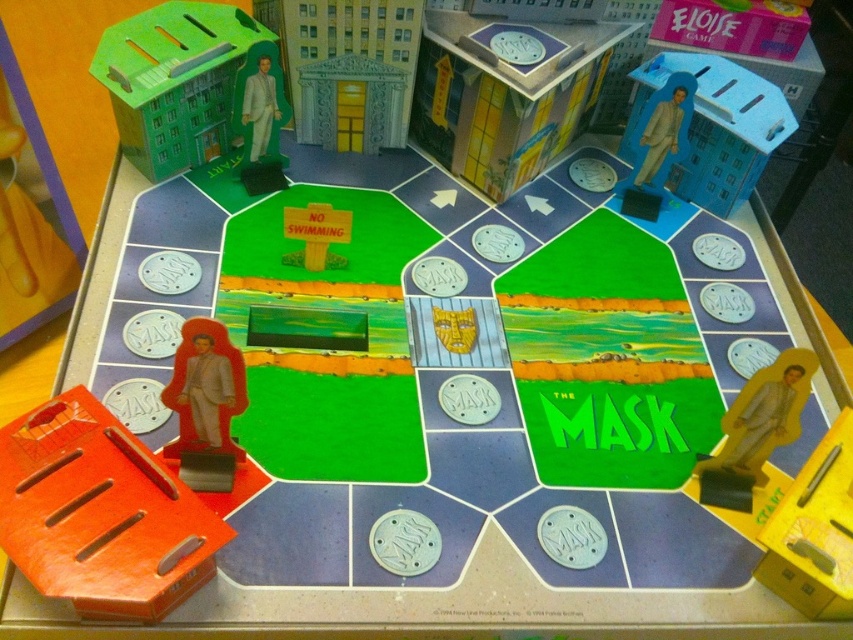
You are setting up the board game and need to place the matte plastic figure at upper right and the matte red figurine at lower left on the board. If the space you have available is only 5 cm wide, which figure should you place first to ensure it fits?

The matte red figurine at lower left should be placed first because it is narrower than the matte plastic figure at upper right, which is wider and might not fit in the 5 cm space.

You are playing The Mask board game and your game piece is the matte gray suit at upper center. There is a matte plastic building at upper center that you need to reach. In which direction should you move to get closer to the building?

You should move to the right to get closer to the matte plastic building at upper center because it is located to the right of the matte gray suit at upper center.

You are playing The Mask board game and need to move your piece to the central area labeled NO SWIMMING. Your current position is the matte red figurine at lower left. Is the path to the center clear of any obstacles like the matte gray suit at upper center?

The matte red figurine at lower left is located below the matte gray suit at upper center, so the path to the central area labeled NO SWIMMING may be blocked by the matte gray suit at upper center depending on the board layout.